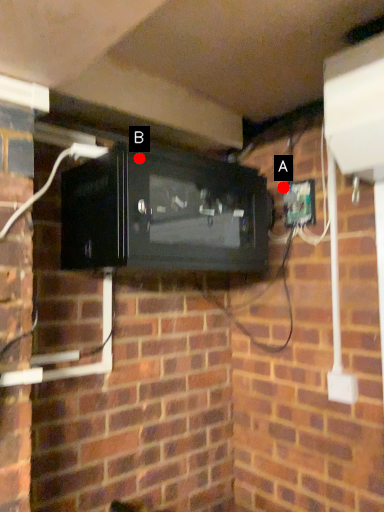
Question: Two points are circled on the image, labeled by A and B beside each circle. Which point is farther to the camera?

Choices:
 (A) A is further
 (B) B is further

Answer: (A)